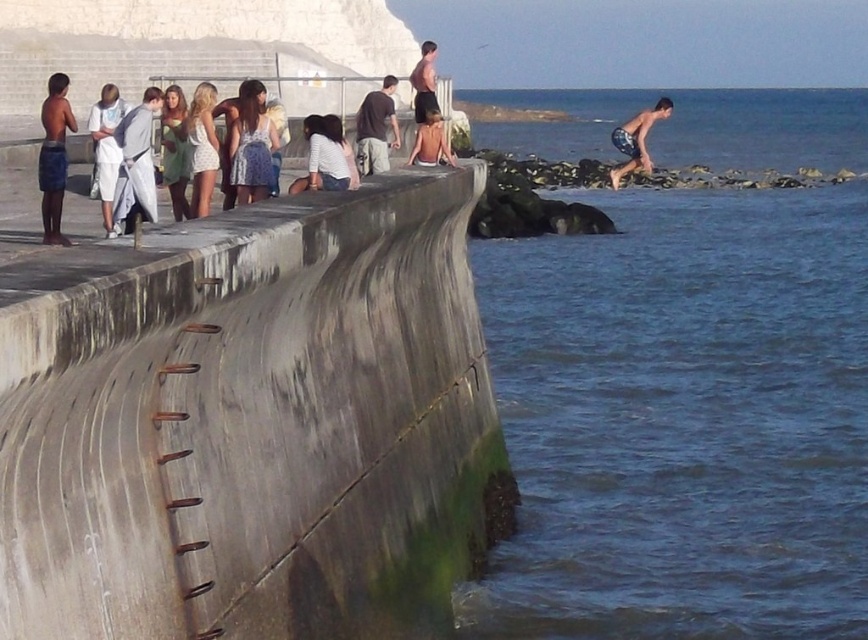
Between point (181, 172) and point (665, 100), which one is positioned behind?

The point (665, 100) is behind.

Which is more to the right, matte white dress at center or blue shorts at right?

blue shorts at right is more to the right.

I want to click on matte white dress at center, so click(175, 148).

Where is `matte white dress at center`? The height and width of the screenshot is (640, 868). matte white dress at center is located at coordinates (175, 148).

Which is behind, point (764, 180) or point (360, 163)?

Positioned behind is point (764, 180).

Does point (576, 184) come behind point (367, 172)?

Yes, it is behind point (367, 172).

Where is `smooth rock coast at right`? The width and height of the screenshot is (868, 640). smooth rock coast at right is located at coordinates (737, 177).

Is point (146, 106) farther from viewer compared to point (436, 102)?

No, it is in front of (436, 102).

Is point (156, 92) positioned in front of point (431, 102)?

That is True.

Find the location of a particular element. Image resolution: width=868 pixels, height=640 pixels. light gray fabric coat at left is located at coordinates (136, 164).